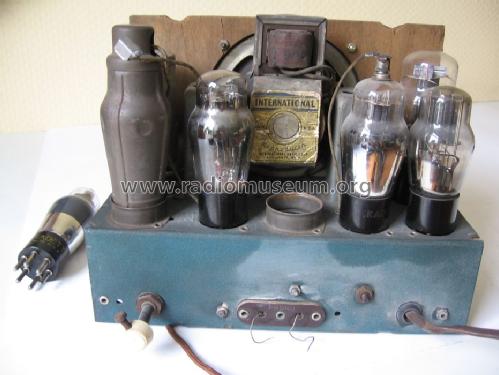
You are a GUI agent. You are given a task and a screenshot of the screen. Output one action in this format:
    pyautogui.click(x=<x>, y=<y>)
    Task: Click on the brown wall
    
    Given the screenshot: What is the action you would take?
    pyautogui.click(x=34, y=62), pyautogui.click(x=484, y=55)